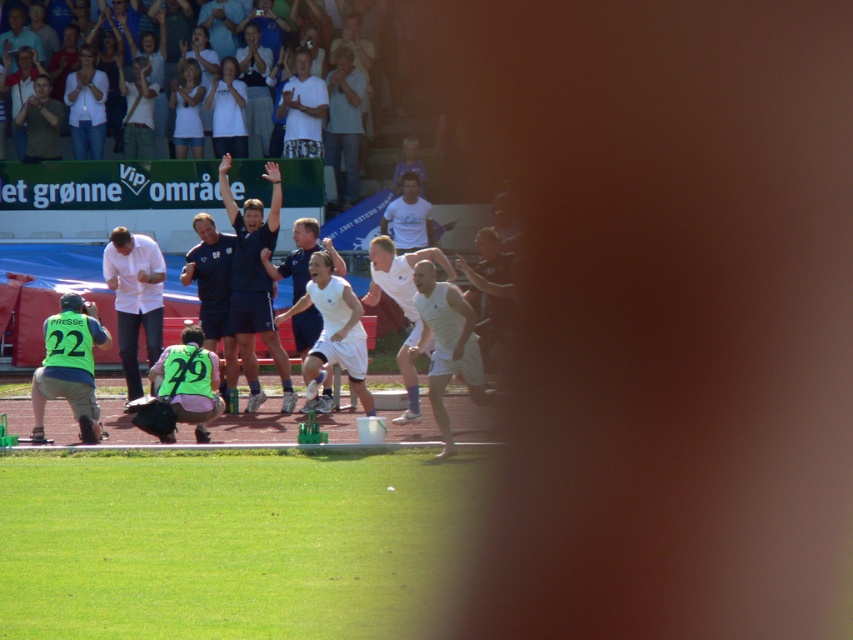
Question: Which point is farther to the camera?

Choices:
 (A) (375, 282)
 (B) (300, 241)

Answer: (B)

Question: Can you confirm if white matte uniform at center is positioned to the left of white matte shirt at upper center?

Choices:
 (A) yes
 (B) no

Answer: (B)

Question: Which object is positioned farthest from the neon green jersey at center?

Choices:
 (A) white matte soccer player at center
 (B) camouflage shirt at upper left
 (C) white matte tank top at center

Answer: (B)

Question: Observing the image, what is the correct spatial positioning of dark blue uniform at center in reference to neon green jersey at lower left?

Choices:
 (A) below
 (B) above

Answer: (B)

Question: Is green grass football field at lower center positioned before neon green jersey at center?

Choices:
 (A) yes
 (B) no

Answer: (A)

Question: Which point is closer to the camera?

Choices:
 (A) (450, 276)
 (B) (84, 397)
 (C) (201, 422)
 (D) (312, 232)

Answer: (C)